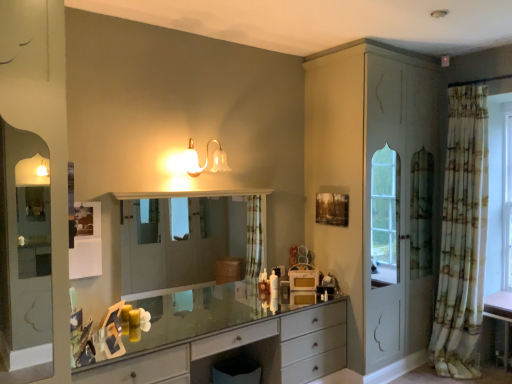
Question: Is clear glass mirror at center bigger or smaller than translucent glass sconce at upper center?

Choices:
 (A) small
 (B) big

Answer: (B)

Question: From the image's perspective, is clear glass mirror at center positioned above or below translucent glass sconce at upper center?

Choices:
 (A) below
 (B) above

Answer: (A)

Question: Based on their relative distances, which object is farther from the matte gray chest of drawers at center?

Choices:
 (A) clear glass mirror at center
 (B) translucent glass sconce at upper center
 (C) printed fabric curtain at right

Answer: (A)

Question: Considering the real-world distances, which object is farthest from the clear glass mirror at center?

Choices:
 (A) printed fabric curtain at right
 (B) matte gray chest of drawers at center
 (C) translucent glass sconce at upper center

Answer: (A)